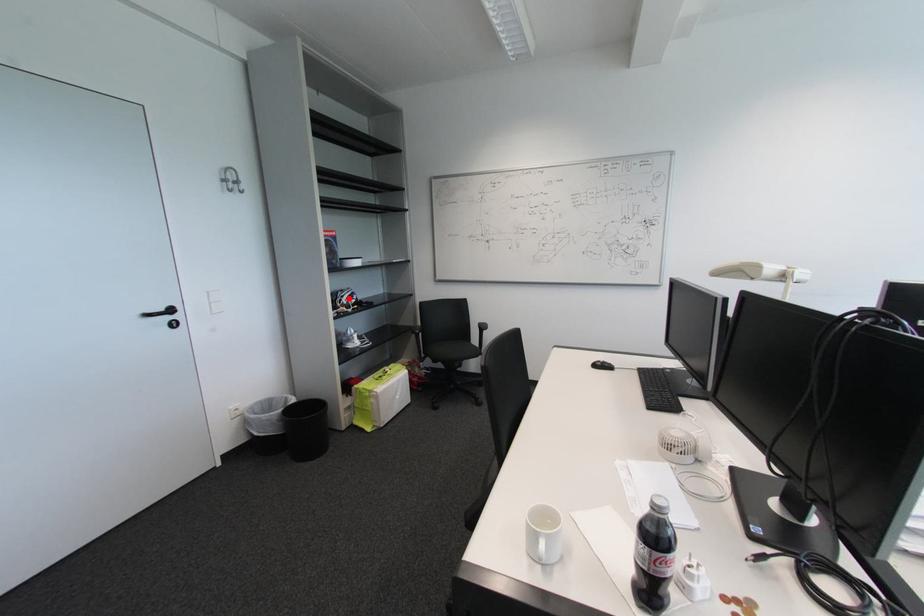
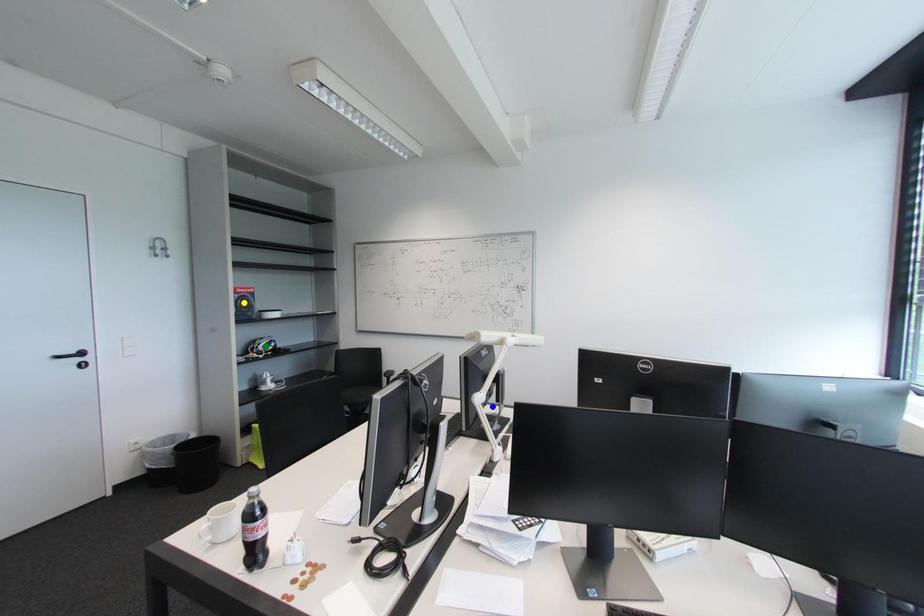
Question: I am providing you with two images of the same scene from different viewpoints. A red point is marked on the first image. You are given multiple points on the second image. In image 2, which mark is for the same physical point as the one in image 1?

Choices:
 (A) blue point
 (B) yellow point
 (C) green point

Answer: (C)